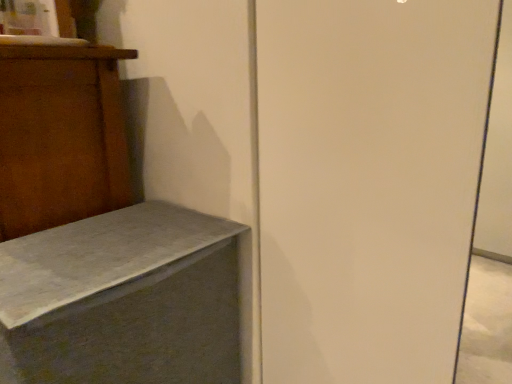
Question: Is matte gray concrete bench at lower left in front of or behind white matte screen door at center in the image?

Choices:
 (A) front
 (B) behind

Answer: (B)

Question: From a real-world perspective, is matte gray concrete bench at lower left positioned above or below white matte screen door at center?

Choices:
 (A) below
 (B) above

Answer: (A)

Question: Would you say matte gray concrete bench at lower left is to the left or to the right of white matte screen door at center in the picture?

Choices:
 (A) right
 (B) left

Answer: (B)

Question: In the image, is white matte screen door at center on the left side or the right side of matte gray concrete bench at lower left?

Choices:
 (A) right
 (B) left

Answer: (A)

Question: In terms of size, does white matte screen door at center appear bigger or smaller than matte gray concrete bench at lower left?

Choices:
 (A) big
 (B) small

Answer: (B)

Question: Considering the positions of white matte screen door at center and matte gray concrete bench at lower left in the image, is white matte screen door at center taller or shorter than matte gray concrete bench at lower left?

Choices:
 (A) tall
 (B) short

Answer: (A)

Question: Is white matte screen door at center in front of or behind matte gray concrete bench at lower left in the image?

Choices:
 (A) behind
 (B) front

Answer: (B)